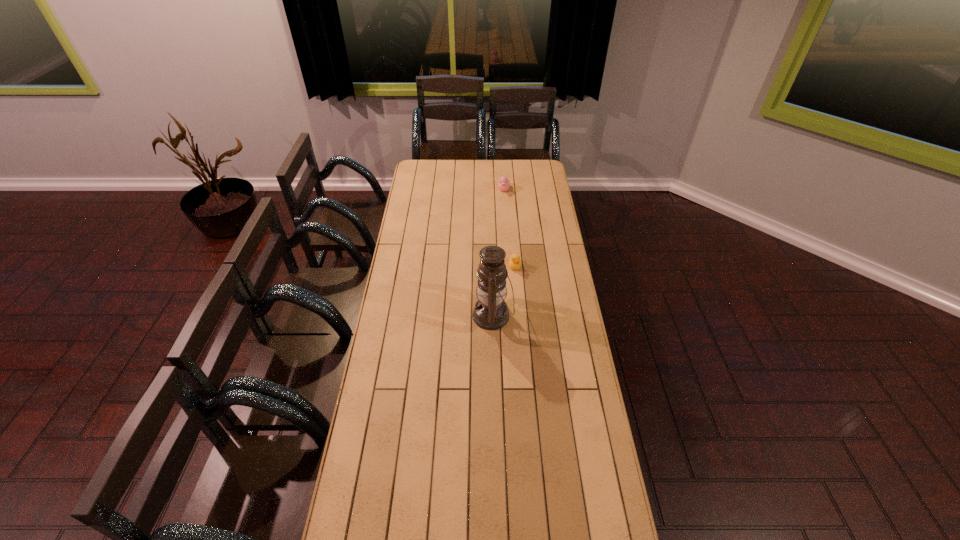
What are the coordinates of `the tallest object` in the screenshot? It's located at (491, 312).

Find the location of a particular element. oil lamp is located at coordinates (491, 312).

Locate an element on the screen. The height and width of the screenshot is (540, 960). the farthest object is located at coordinates (503, 184).

Where is `the second farthest object`? the second farthest object is located at coordinates (514, 262).

The image size is (960, 540). I want to click on free space located 0.260m on the back of the tallest object, so click(x=492, y=257).

Identify the location of vacant area located on the front-facing side of the farthest object. (507, 232).

You are a GUI agent. You are given a task and a screenshot of the screen. Output one action in this format:
    pyautogui.click(x=<x>, y=<y>)
    Task: Click on the vacant space located on the face of the nearer duckling
    
    Given the screenshot: What is the action you would take?
    pyautogui.click(x=518, y=310)

This screenshot has height=540, width=960. Find the location of `free region at the far edge`. free region at the far edge is located at coordinates (470, 173).

The image size is (960, 540). Identify the location of free space at the left edge of the desktop. (402, 322).

In the image, there is a desktop. Where is `vacant region at the right edge`? vacant region at the right edge is located at coordinates (555, 281).